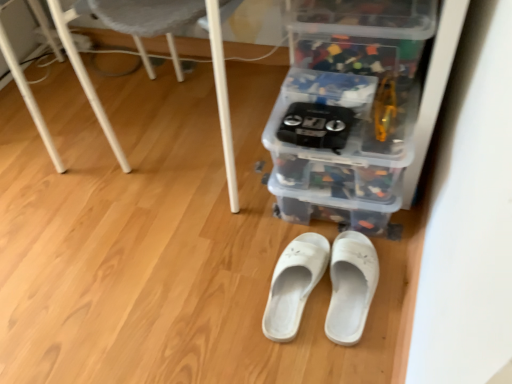
This screenshot has width=512, height=384. Identify the location of free space in front of white fabric slippers at center, the 1th footwear from the left. (301, 361).